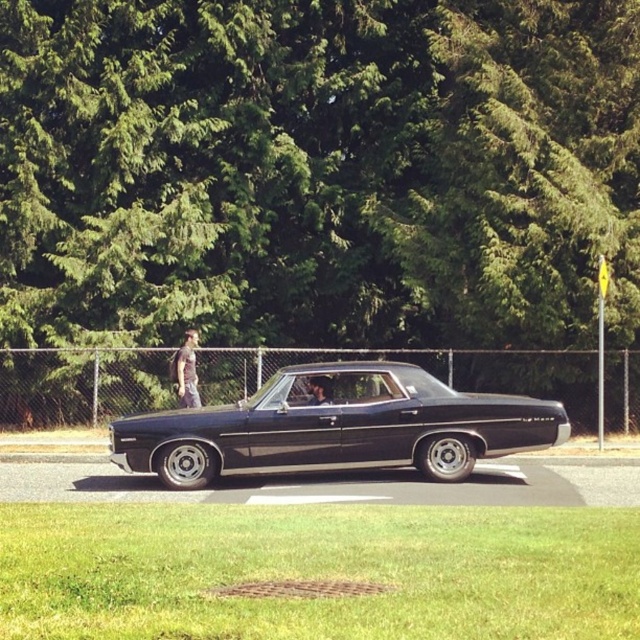
Question: Which point is closer to the camera taking this photo?

Choices:
 (A) (337, 369)
 (B) (188, 380)

Answer: (A)

Question: Does shiny black car at center appear over gray fabric jacket at left?

Choices:
 (A) yes
 (B) no

Answer: (B)

Question: Can you confirm if shiny black car at center is positioned to the right of gray fabric jacket at left?

Choices:
 (A) no
 (B) yes

Answer: (B)

Question: Does shiny black car at center have a larger size compared to gray fabric jacket at left?

Choices:
 (A) no
 (B) yes

Answer: (B)

Question: Among these points, which one is farthest from the camera?

Choices:
 (A) (163, 484)
 (B) (176, 353)

Answer: (B)